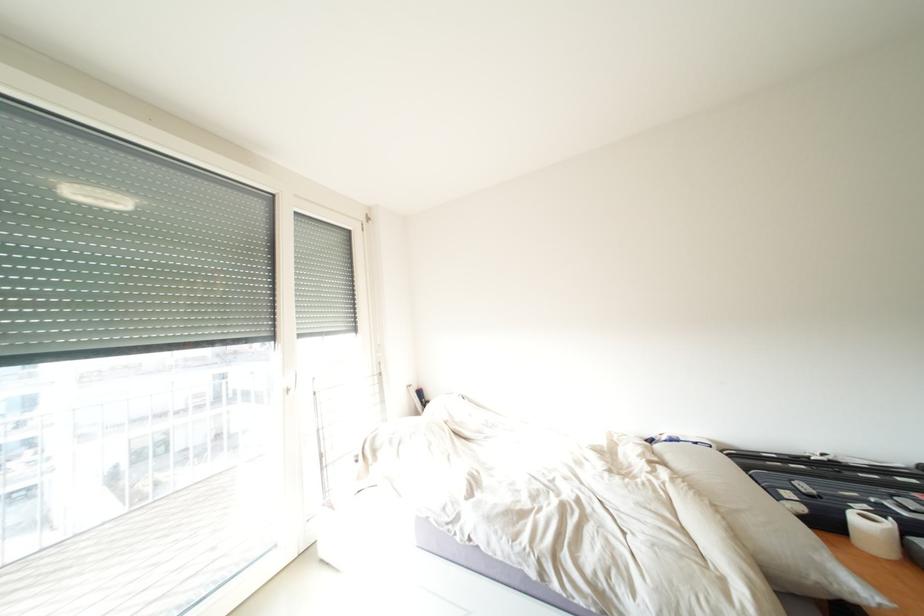
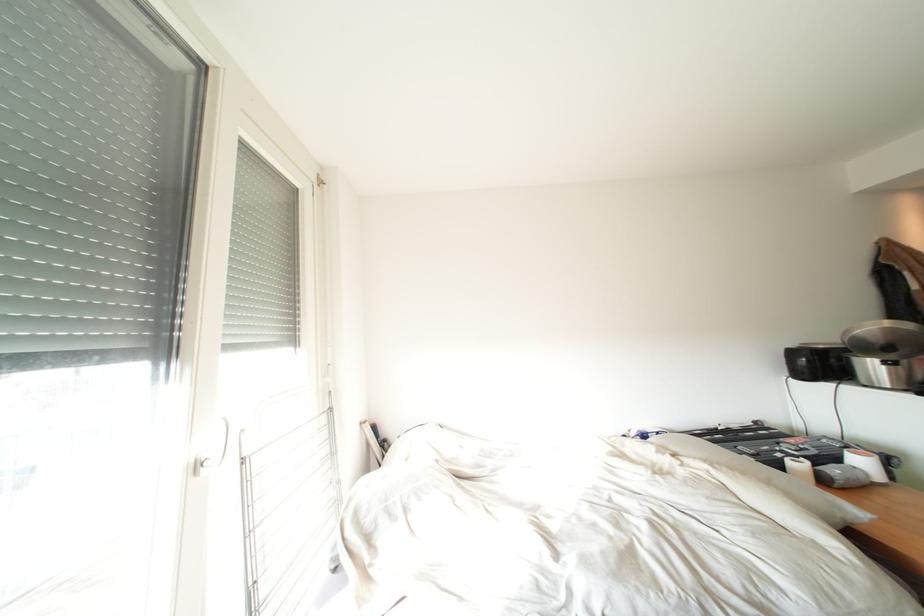
What movement of the cameraman would produce the second image?

The cameraman walked toward left, forward.